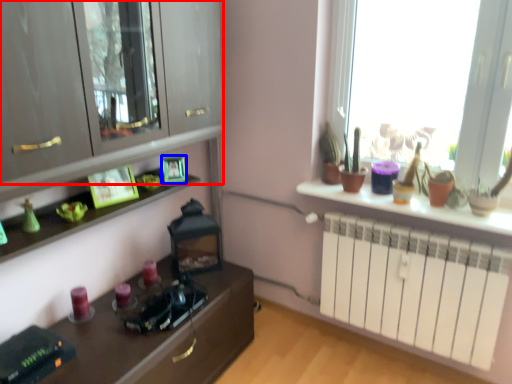
Question: Which object is further to the camera taking this photo, cabinetry (highlighted by a red box) or picture frame (highlighted by a blue box)?

Choices:
 (A) cabinetry
 (B) picture frame

Answer: (B)